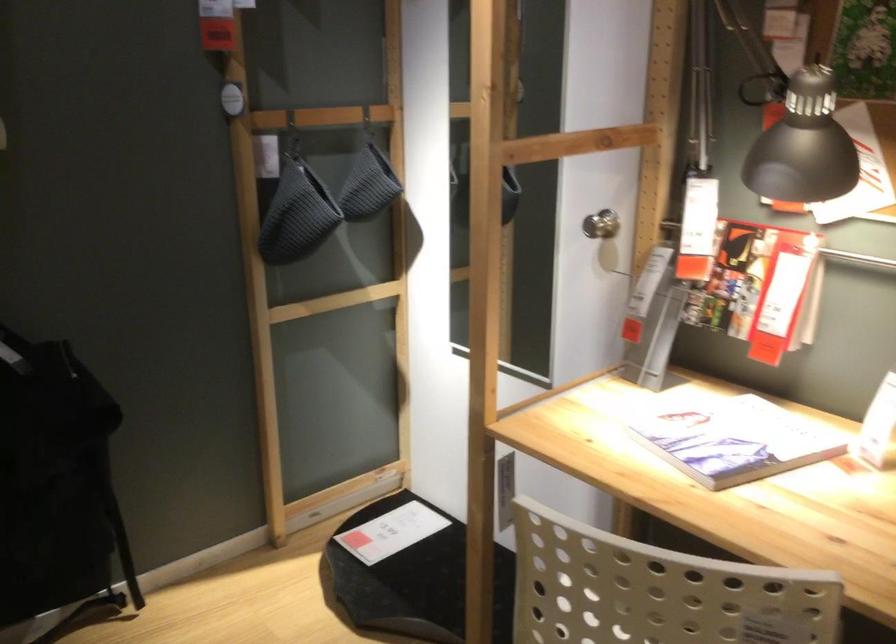
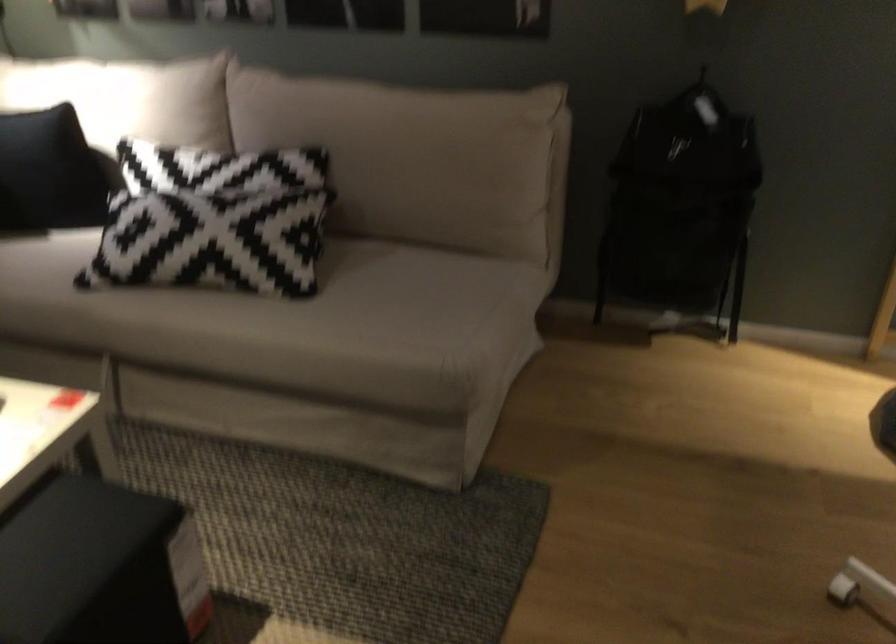
First-person continuous shooting, in which direction is the camera rotating?

The rotation direction of the camera is left-down.